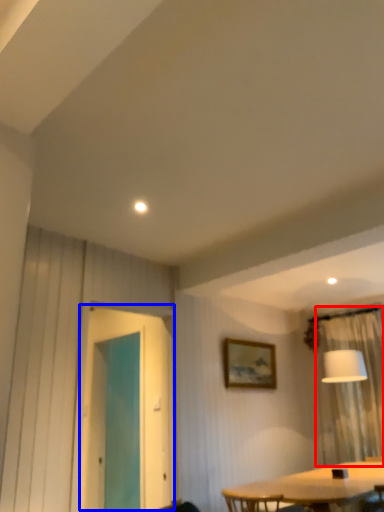
Question: Among these objects, which one is farthest to the camera, curtain (highlighted by a red box) or screen door (highlighted by a blue box)?

Choices:
 (A) curtain
 (B) screen door

Answer: (A)